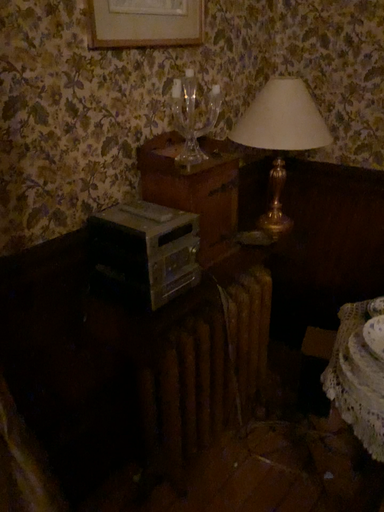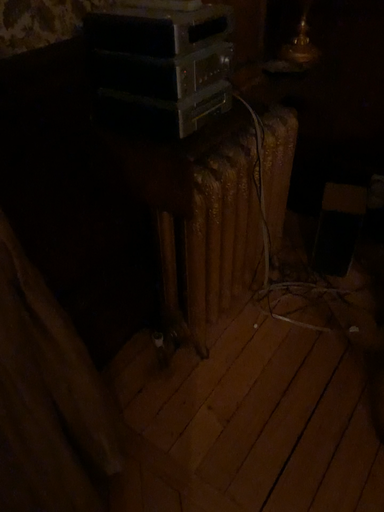
Question: How did the camera likely rotate when shooting the video?

Choices:
 (A) rotated upward
 (B) rotated downward

Answer: (B)